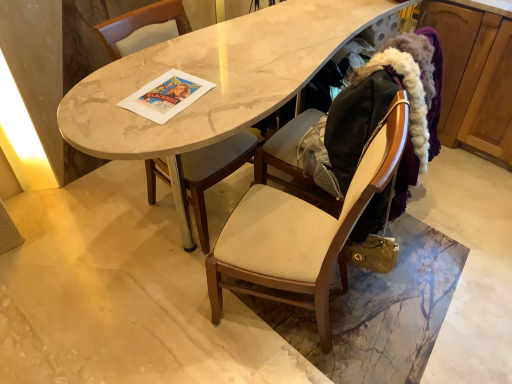
The width and height of the screenshot is (512, 384). Find the location of `free location to the left of beige fabric chair at center, marked as the 2th chair in a left-to-right arrangement`. free location to the left of beige fabric chair at center, marked as the 2th chair in a left-to-right arrangement is located at coordinates (172, 317).